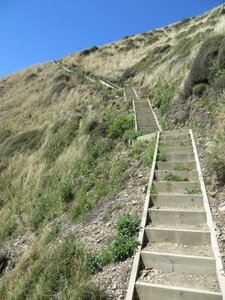
Find the location of a particular element. The image size is (225, 300). 1 right side of stairs is located at coordinates (219, 134).